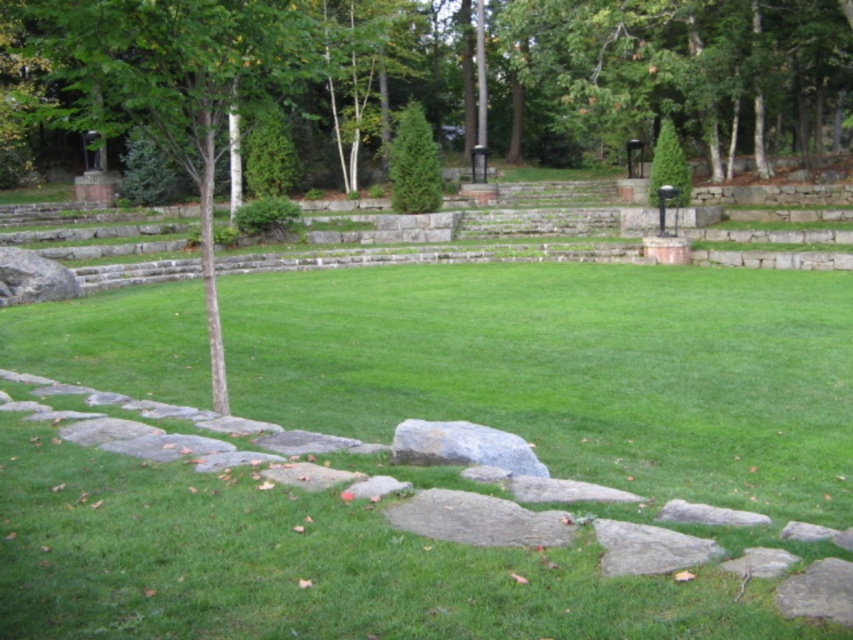
You are standing at the center of the stone pathway in the park. You want to find the green smooth tree at left. In which direction should you look to see it?

The green smooth tree at left is located at point coordinates (178, 81), which is to the left side of the scene. Therefore, you should look to your left to see the green smooth tree at left.